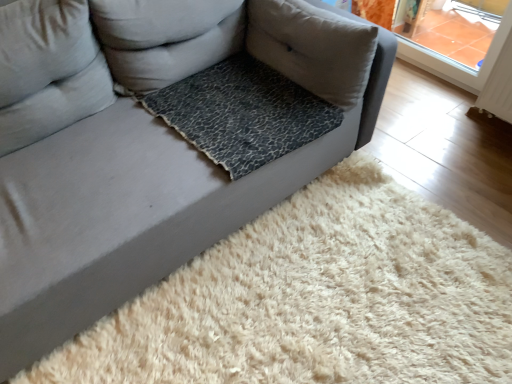
At what (x,y) coordinates should I click in order to perform the action: click on leopard print fabric pillow at center, which is the second pillow in right-to-left order. Please return your answer as a coordinate pair (x, y). This screenshot has height=384, width=512. Looking at the image, I should click on (165, 38).

Measure the distance between point (115, 70) and camera.

Point (115, 70) and camera are 1.64 meters apart from each other.

Describe the element at coordinates (48, 70) in the screenshot. I see `light gray fabric pillow at upper left, placed as the 1th pillow when sorted from left to right` at that location.

Locate an element on the screen. Image resolution: width=512 pixels, height=384 pixels. light gray fabric pillow at upper left, arranged as the third pillow when viewed from the right is located at coordinates (48, 70).

You are a GUI agent. You are given a task and a screenshot of the screen. Output one action in this format:
    pyautogui.click(x=<x>, y=<y>)
    Task: Click on the leopard print fabric pillow at center, acting as the 1th pillow starting from the right
    
    Given the screenshot: What is the action you would take?
    pyautogui.click(x=313, y=48)

Is leopard print fabric pillow at center, placed as the third pillow when sorted from left to right, looking in the opposite direction of leopard print fabric at center?

Yes, leopard print fabric pillow at center, placed as the third pillow when sorted from left to right, is positioned with its back facing leopard print fabric at center.

Considering the relative sizes of leopard print fabric pillow at center, placed as the third pillow when sorted from left to right, and leopard print fabric at center in the image provided, is leopard print fabric pillow at center, placed as the third pillow when sorted from left to right, shorter than leopard print fabric at center?

Incorrect, the height of leopard print fabric pillow at center, placed as the third pillow when sorted from left to right, does not fall short of that of leopard print fabric at center.

Would you say leopard print fabric at center is part of leopard print fabric pillow at center, acting as the 1th pillow starting from the right,'s contents?

No, leopard print fabric at center is not inside leopard print fabric pillow at center, acting as the 1th pillow starting from the right.

Can you confirm if leopard print fabric pillow at center, acting as the 1th pillow starting from the right, is thinner than leopard print fabric at center?

Indeed, leopard print fabric pillow at center, acting as the 1th pillow starting from the right, has a lesser width compared to leopard print fabric at center.

Who is shorter, leopard print fabric at center or leopard print fabric pillow at center, acting as the 1th pillow starting from the right?

With less height is leopard print fabric at center.

Can you confirm if leopard print fabric at center is wider than leopard print fabric pillow at center, acting as the 1th pillow starting from the right?

Yes.

Looking at this image, which is correct: leopard print fabric at center is inside leopard print fabric pillow at center, placed as the third pillow when sorted from left to right, or outside of it?

leopard print fabric at center lies outside leopard print fabric pillow at center, placed as the third pillow when sorted from left to right.

From the image's perspective, is leopard print fabric at center located above leopard print fabric pillow at center, placed as the third pillow when sorted from left to right?

No, from the image's perspective, leopard print fabric at center is not above leopard print fabric pillow at center, placed as the third pillow when sorted from left to right.

Is light gray fabric pillow at upper left, placed as the 1th pillow when sorted from left to right, far away from leopard print fabric at center?

No, light gray fabric pillow at upper left, placed as the 1th pillow when sorted from left to right, is not far away from leopard print fabric at center.

Is light gray fabric pillow at upper left, arranged as the third pillow when viewed from the right, turned away from leopard print fabric at center?

light gray fabric pillow at upper left, arranged as the third pillow when viewed from the right, does not have its back to leopard print fabric at center.

Based on the photo, between light gray fabric pillow at upper left, placed as the 1th pillow when sorted from left to right, and leopard print fabric at center, which one is positioned in front?

light gray fabric pillow at upper left, placed as the 1th pillow when sorted from left to right.

From the image's perspective, relative to leopard print fabric pillow at center, placed as the third pillow when sorted from left to right, is light gray fabric pillow at upper left, arranged as the third pillow when viewed from the right, above or below?

light gray fabric pillow at upper left, arranged as the third pillow when viewed from the right, is below leopard print fabric pillow at center, placed as the third pillow when sorted from left to right.

Is light gray fabric pillow at upper left, arranged as the third pillow when viewed from the right, outside of leopard print fabric pillow at center, placed as the third pillow when sorted from left to right?

Indeed, light gray fabric pillow at upper left, arranged as the third pillow when viewed from the right, is completely outside leopard print fabric pillow at center, placed as the third pillow when sorted from left to right.

Does point (88, 30) appear closer or farther from the camera than point (259, 12)?

Point (88, 30) is positioned closer to the camera compared to point (259, 12).

From a real-world perspective, who is located higher, light gray fabric pillow at upper left, arranged as the third pillow when viewed from the right, or leopard print fabric pillow at center, placed as the third pillow when sorted from left to right?

light gray fabric pillow at upper left, arranged as the third pillow when viewed from the right, is physically above.

Is leopard print fabric pillow at center, acting as the 1th pillow starting from the right, surrounding leopard print fabric pillow at center, the second pillow when ordered from left to right?

A: Definitely not — leopard print fabric pillow at center, the second pillow when ordered from left to right, is not inside leopard print fabric pillow at center, acting as the 1th pillow starting from the right.

Is point (330, 80) closer to viewer compared to point (114, 1)?

No, it is behind (114, 1).

Which is more to the right, leopard print fabric pillow at center, acting as the 1th pillow starting from the right, or leopard print fabric pillow at center, which is the second pillow in right-to-left order?

From the viewer's perspective, leopard print fabric pillow at center, acting as the 1th pillow starting from the right, appears more on the right side.

From a real-world perspective, is leopard print fabric pillow at center, placed as the third pillow when sorted from left to right, positioned under leopard print fabric pillow at center, which is the second pillow in right-to-left order, based on gravity?

Yes, from a real-world perspective, leopard print fabric pillow at center, placed as the third pillow when sorted from left to right, is below leopard print fabric pillow at center, which is the second pillow in right-to-left order.

What's the angular difference between leopard print fabric pillow at center, the second pillow when ordered from left to right, and leopard print fabric at center's facing directions?

They differ by 0.927 degrees in their facing directions.

Is leopard print fabric pillow at center, which is the second pillow in right-to-left order, behind leopard print fabric at center?

Answer: No, it is in front of leopard print fabric at center.

Can you confirm if leopard print fabric pillow at center, which is the second pillow in right-to-left order, is bigger than leopard print fabric at center?

Yes.

Is leopard print fabric at center at the back of leopard print fabric pillow at center, which is the second pillow in right-to-left order?

No, leopard print fabric at center is not at the back of leopard print fabric pillow at center, which is the second pillow in right-to-left order.

Considering the relative sizes of leopard print fabric pillow at center, which is the second pillow in right-to-left order, and light gray fabric pillow at upper left, placed as the 1th pillow when sorted from left to right, in the image provided, is leopard print fabric pillow at center, which is the second pillow in right-to-left order, bigger than light gray fabric pillow at upper left, placed as the 1th pillow when sorted from left to right,?

Correct, leopard print fabric pillow at center, which is the second pillow in right-to-left order, is larger in size than light gray fabric pillow at upper left, placed as the 1th pillow when sorted from left to right.

Considering the positions of objects leopard print fabric pillow at center, the second pillow when ordered from left to right, and light gray fabric pillow at upper left, arranged as the third pillow when viewed from the right, in the image provided, who is in front, leopard print fabric pillow at center, the second pillow when ordered from left to right, or light gray fabric pillow at upper left, arranged as the third pillow when viewed from the right,?

Positioned in front is light gray fabric pillow at upper left, arranged as the third pillow when viewed from the right.

Is leopard print fabric pillow at center, which is the second pillow in right-to-left order, beside light gray fabric pillow at upper left, arranged as the third pillow when viewed from the right?

No.

At what (x,y) coordinates should I click in order to perform the action: click on pillow lying on the right of leopard print fabric at center. Please return your answer as a coordinate pair (x, y). This screenshot has height=384, width=512. Looking at the image, I should click on (313, 48).

Locate an element on the screen. The width and height of the screenshot is (512, 384). dog bed below the leopard print fabric pillow at center, placed as the third pillow when sorted from left to right (from a real-world perspective) is located at coordinates pyautogui.click(x=242, y=113).

Based on their spatial positions, is light gray fabric pillow at upper left, arranged as the third pillow when viewed from the right, or leopard print fabric pillow at center, acting as the 1th pillow starting from the right, closer to leopard print fabric at center?

leopard print fabric pillow at center, acting as the 1th pillow starting from the right, is closer to leopard print fabric at center.

Looking at the image, which one is located further to light gray fabric pillow at upper left, arranged as the third pillow when viewed from the right, leopard print fabric pillow at center, placed as the third pillow when sorted from left to right, or leopard print fabric at center?

The object further to light gray fabric pillow at upper left, arranged as the third pillow when viewed from the right, is leopard print fabric pillow at center, placed as the third pillow when sorted from left to right.

Based on their spatial positions, is leopard print fabric pillow at center, which is the second pillow in right-to-left order, or leopard print fabric pillow at center, acting as the 1th pillow starting from the right, closer to light gray fabric pillow at upper left, placed as the 1th pillow when sorted from left to right?

Based on the image, leopard print fabric pillow at center, which is the second pillow in right-to-left order, appears to be nearer to light gray fabric pillow at upper left, placed as the 1th pillow when sorted from left to right.

Based on their spatial positions, is leopard print fabric pillow at center, which is the second pillow in right-to-left order, or light gray fabric pillow at upper left, placed as the 1th pillow when sorted from left to right, further from leopard print fabric pillow at center, acting as the 1th pillow starting from the right?

light gray fabric pillow at upper left, placed as the 1th pillow when sorted from left to right, lies further to leopard print fabric pillow at center, acting as the 1th pillow starting from the right, than the other object.

Estimate the real-world distances between objects in this image. Which object is further from light gray fabric pillow at upper left, placed as the 1th pillow when sorted from left to right, leopard print fabric at center or leopard print fabric pillow at center, the second pillow when ordered from left to right?

Among the two, leopard print fabric at center is located further to light gray fabric pillow at upper left, placed as the 1th pillow when sorted from left to right.

Based on their spatial positions, is leopard print fabric at center or leopard print fabric pillow at center, acting as the 1th pillow starting from the right, further from light gray fabric pillow at upper left, placed as the 1th pillow when sorted from left to right?

Based on the image, leopard print fabric pillow at center, acting as the 1th pillow starting from the right, appears to be further to light gray fabric pillow at upper left, placed as the 1th pillow when sorted from left to right.

Estimate the real-world distances between objects in this image. Which object is further from leopard print fabric pillow at center, the second pillow when ordered from left to right, leopard print fabric pillow at center, placed as the third pillow when sorted from left to right, or leopard print fabric at center?

leopard print fabric pillow at center, placed as the third pillow when sorted from left to right, is further to leopard print fabric pillow at center, the second pillow when ordered from left to right.

Estimate the real-world distances between objects in this image. Which object is further from leopard print fabric at center, light gray fabric pillow at upper left, arranged as the third pillow when viewed from the right, or leopard print fabric pillow at center, which is the second pillow in right-to-left order?

Based on the image, light gray fabric pillow at upper left, arranged as the third pillow when viewed from the right, appears to be further to leopard print fabric at center.

What are the coordinates of `pillow between light gray fabric pillow at upper left, arranged as the third pillow when viewed from the right, and leopard print fabric at center from left to right` in the screenshot? It's located at (165, 38).

Locate an element on the screen. dog bed between leopard print fabric pillow at center, the second pillow when ordered from left to right, and leopard print fabric pillow at center, placed as the third pillow when sorted from left to right, from left to right is located at coordinates (242, 113).

Where is `pillow situated between light gray fabric pillow at upper left, placed as the 1th pillow when sorted from left to right, and leopard print fabric pillow at center, placed as the third pillow when sorted from left to right, from left to right`? The height and width of the screenshot is (384, 512). pillow situated between light gray fabric pillow at upper left, placed as the 1th pillow when sorted from left to right, and leopard print fabric pillow at center, placed as the third pillow when sorted from left to right, from left to right is located at coordinates (165, 38).

The image size is (512, 384). Identify the location of dog bed between light gray fabric pillow at upper left, arranged as the third pillow when viewed from the right, and leopard print fabric pillow at center, acting as the 1th pillow starting from the right, from left to right. (242, 113).